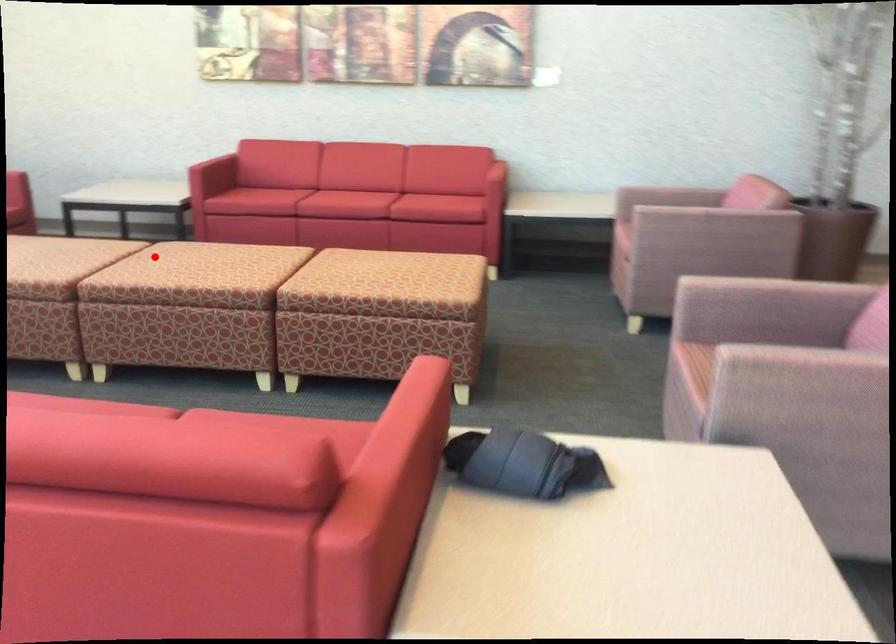
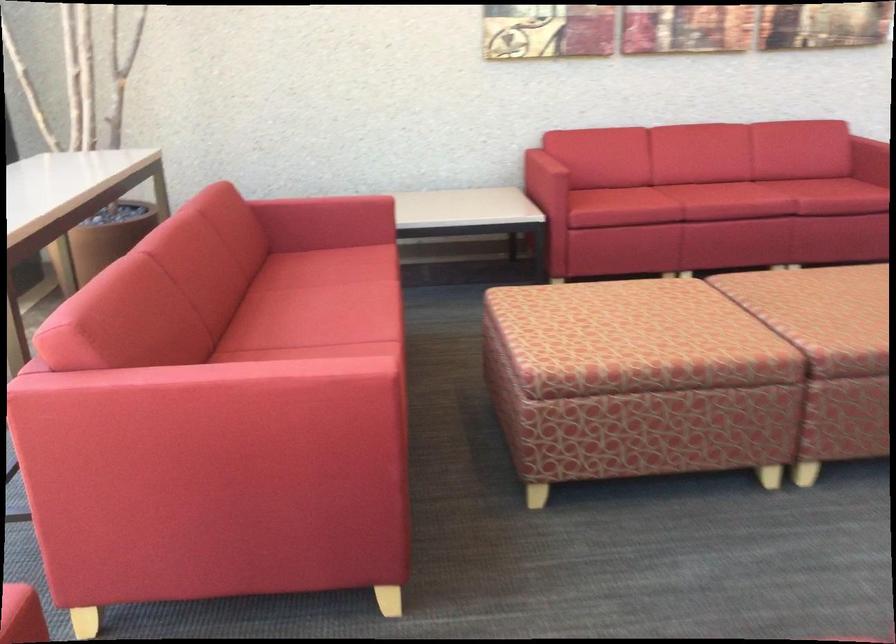
Question: A red point is marked in image1. In image2, is the corresponding 3D point closer to the camera or farther? Reply with the corresponding letter.

Choices:
 (A) The corresponding 3D point is closer.
 (B) The corresponding 3D point is farther.

Answer: (A)